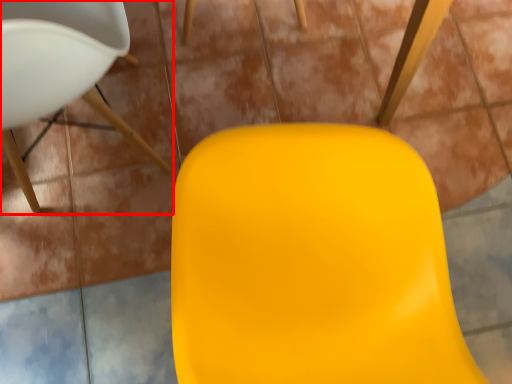
Question: Considering the relative positions of chair (annotated by the red box) and swivel chair in the image provided, where is chair (annotated by the red box) located with respect to the staircase?

Choices:
 (A) right
 (B) left

Answer: (B)